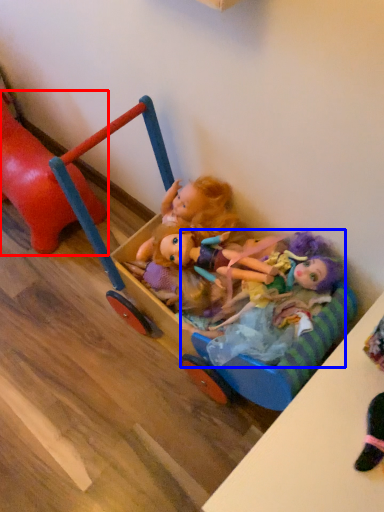
Question: Among these objects, which one is nearest to the camera, toy (highlighted by a red box) or doll (highlighted by a blue box)?

Choices:
 (A) toy
 (B) doll

Answer: (B)